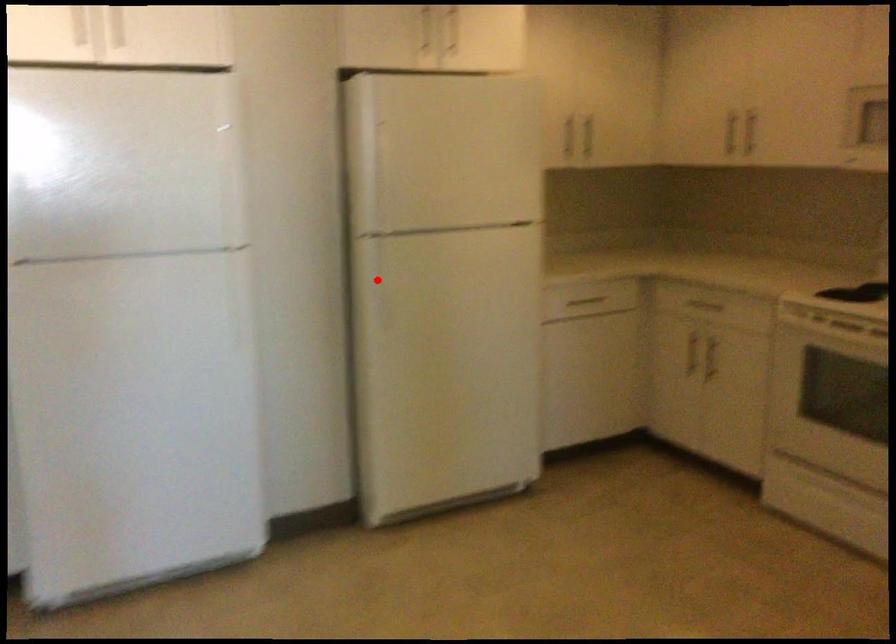
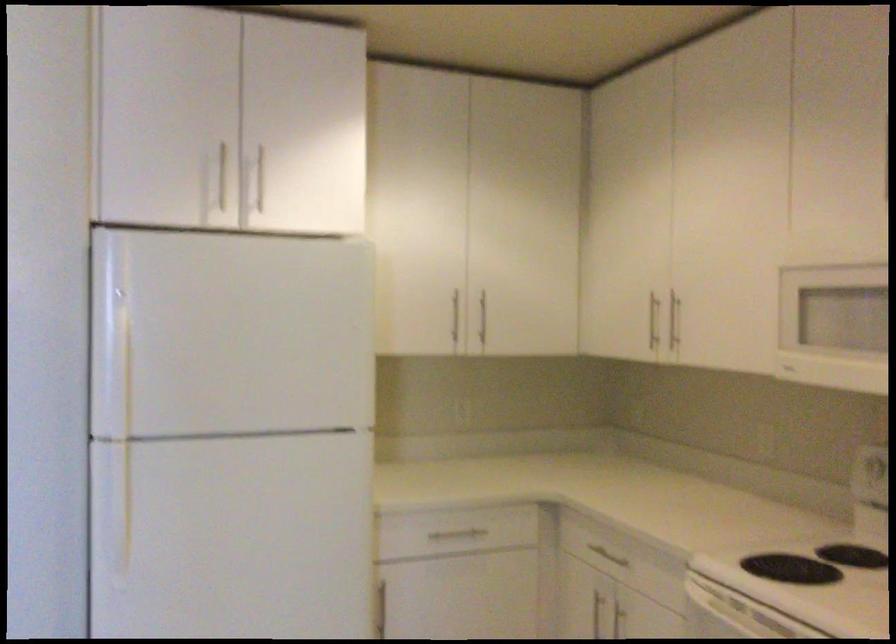
Question: I am providing you with two images of the same scene from different viewpoints. Given a red point in image1, look at the same physical point in image2. Is it:

Choices:
 (A) Closer to the viewpoint
 (B) Farther from the viewpoint

Answer: (A)